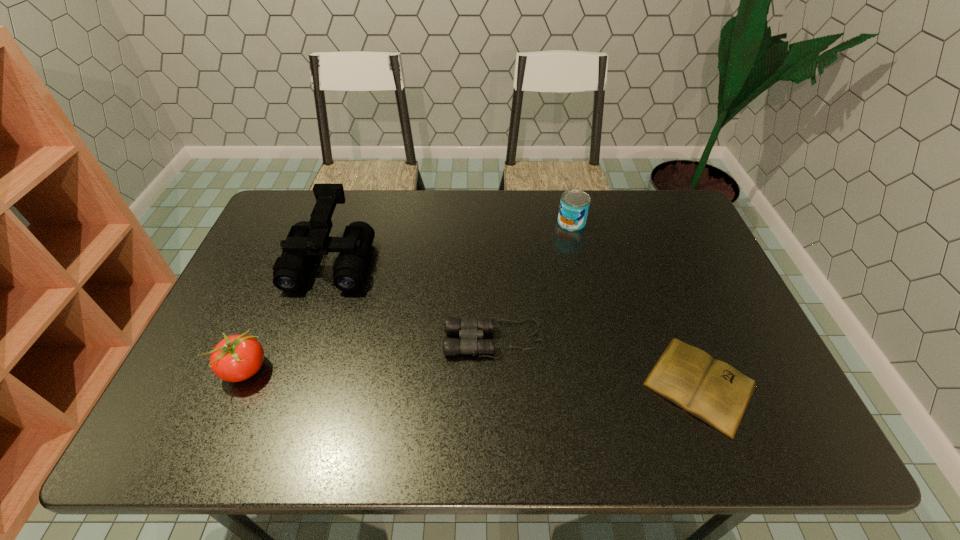
Identify the location of object at the right edge. (715, 392).

Where is `object at the far left corner`? This screenshot has width=960, height=540. object at the far left corner is located at coordinates (305, 239).

You are a GUI agent. You are given a task and a screenshot of the screen. Output one action in this format:
    pyautogui.click(x=<x>, y=<y>)
    Task: Click on the object at the near right corner
    The height and width of the screenshot is (540, 960).
    Given the screenshot: What is the action you would take?
    pyautogui.click(x=715, y=392)

Identify the location of blank space at the far edge of the desktop. Image resolution: width=960 pixels, height=540 pixels. (417, 198).

At what (x,y) coordinates should I click in order to perform the action: click on vacant space at the near edge of the desktop. Please return your answer as a coordinate pair (x, y). The image size is (960, 540). Looking at the image, I should click on (420, 445).

What are the coordinates of `vacant space at the left edge` in the screenshot? It's located at (221, 319).

The width and height of the screenshot is (960, 540). In order to click on vacant space at the right edge in this screenshot , I will do `click(693, 299)`.

Find the location of a particular element. This screenshot has height=540, width=960. empty space that is in between the shorter binoculars and the tallest object is located at coordinates (413, 299).

Image resolution: width=960 pixels, height=540 pixels. Identify the location of free point between the shortest object and the can. (636, 303).

What are the coordinates of `free space between the third object from left to right and the rightmost object` in the screenshot? It's located at (597, 362).